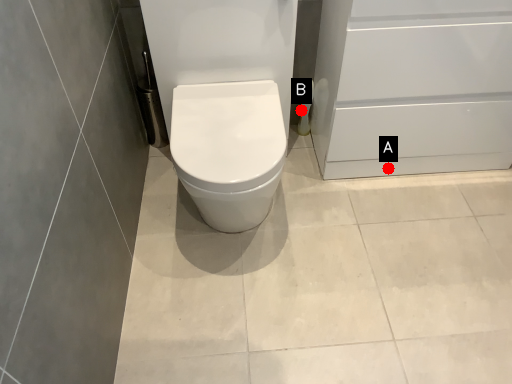
Question: Two points are circled on the image, labeled by A and B beside each circle. Which point is farther from the camera taking this photo?

Choices:
 (A) A is further
 (B) B is further

Answer: (B)